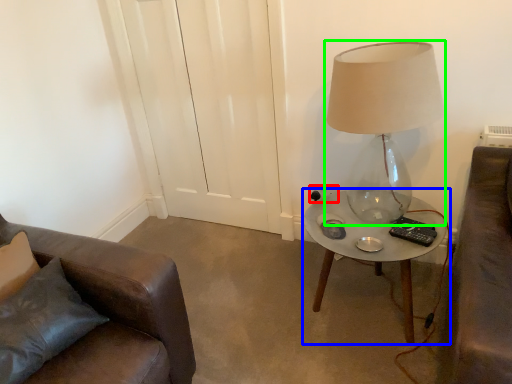
Question: Estimate the real-world distances between objects in this image. Which object is closer to electric outlet (highlighted by a red box), table (highlighted by a blue box) or lamp (highlighted by a green box)?

Choices:
 (A) table
 (B) lamp

Answer: (A)